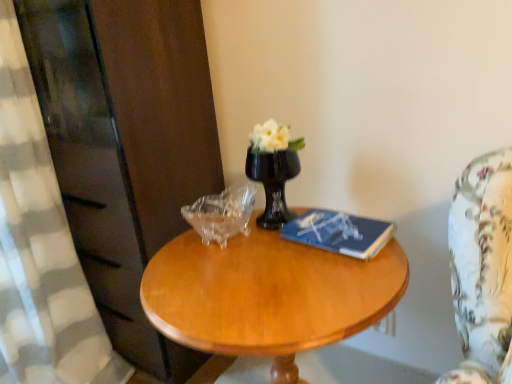
The height and width of the screenshot is (384, 512). In order to click on transparent glass piggy bank at center in this screenshot , I will do `click(222, 213)`.

What is the approximate width of blue matte book at center?

blue matte book at center is 6.33 inches wide.

Measure the distance between blue matte book at center and camera.

blue matte book at center is 36.08 inches away from camera.

This screenshot has height=384, width=512. Describe the element at coordinates (273, 183) in the screenshot. I see `black glass vase at center` at that location.

The image size is (512, 384). Find the location of `white textured curtain at left`. white textured curtain at left is located at coordinates (40, 248).

This screenshot has height=384, width=512. Describe the element at coordinates (267, 295) in the screenshot. I see `light brown wood coffee table at center` at that location.

The width and height of the screenshot is (512, 384). Find the location of `transparent glass piggy bank at center`. transparent glass piggy bank at center is located at coordinates (222, 213).

Identify the location of book located above the light brown wood coffee table at center (from a real-world perspective). The width and height of the screenshot is (512, 384). (339, 232).

Between light brown wood coffee table at center and blue matte book at center, which one is positioned in front?

light brown wood coffee table at center is in front.

In terms of width, does light brown wood coffee table at center look wider or thinner when compared to blue matte book at center?

Considering their sizes, light brown wood coffee table at center looks broader than blue matte book at center.

Which of these two, black glass vase at center or blue matte book at center, is thinner?

With smaller width is black glass vase at center.

Is black glass vase at center taller or shorter than blue matte book at center?

Considering their sizes, black glass vase at center has more height than blue matte book at center.

Would you say black glass vase at center is outside blue matte book at center?

black glass vase at center lies outside blue matte book at center's area.

Based on the photo, from a real-world perspective, who is located lower, transparent glass piggy bank at center or black glass vase at center?

From a 3D spatial view, transparent glass piggy bank at center is below.

Is transparent glass piggy bank at center far away from black glass vase at center?

transparent glass piggy bank at center is near black glass vase at center, not far away.

Which of these two, transparent glass piggy bank at center or black glass vase at center, is smaller?

With smaller size is transparent glass piggy bank at center.

Is black glass vase at center at the back of transparent glass piggy bank at center?

No, black glass vase at center is not at the back of transparent glass piggy bank at center.

From the image's perspective, is transparent glass piggy bank at center located above or below light brown wood coffee table at center?

Clearly, from the image's perspective, transparent glass piggy bank at center is above light brown wood coffee table at center.

From a real-world perspective, relative to light brown wood coffee table at center, is transparent glass piggy bank at center vertically above or below?

transparent glass piggy bank at center is above light brown wood coffee table at center.

Is transparent glass piggy bank at center behind light brown wood coffee table at center?

Yes, transparent glass piggy bank at center is further from the camera.

Can we say blue matte book at center lies outside light brown wood coffee table at center?

No.

In terms of size, does blue matte book at center appear bigger or smaller than light brown wood coffee table at center?

Considering their sizes, blue matte book at center takes up less space than light brown wood coffee table at center.

Between blue matte book at center and light brown wood coffee table at center, which one appears on the left side from the viewer's perspective?

Positioned to the left is light brown wood coffee table at center.

Considering the sizes of objects white textured curtain at left and light brown wood coffee table at center in the image provided, who is wider, white textured curtain at left or light brown wood coffee table at center?

With larger width is light brown wood coffee table at center.

Is white textured curtain at left aimed at light brown wood coffee table at center?

Yes, white textured curtain at left is aimed at light brown wood coffee table at center.

From the picture: In the image, is white textured curtain at left positioned in front of or behind light brown wood coffee table at center?

Clearly, white textured curtain at left is behind light brown wood coffee table at center.

From a real-world perspective, between light brown wood coffee table at center and white textured curtain at left, who is vertically higher?

In real-world perspective, white textured curtain at left is above.

Consider the image. Is light brown wood coffee table at center positioned far away from white textured curtain at left?

No.

From the image's perspective, is light brown wood coffee table at center on white textured curtain at left?

Actually, light brown wood coffee table at center appears below white textured curtain at left in the image.

Locate an element on the screen. The height and width of the screenshot is (384, 512). book above the light brown wood coffee table at center (from the image's perspective) is located at coordinates (339, 232).

Find the location of `vase on the left of blue matte book at center`. vase on the left of blue matte book at center is located at coordinates (273, 183).

Consider the image. Looking at the image, which one is located closer to blue matte book at center, white textured curtain at left or light brown wood coffee table at center?

light brown wood coffee table at center is positioned closer to the anchor blue matte book at center.

When comparing their distances from black glass vase at center, does blue matte book at center or transparent glass piggy bank at center seem further?

Based on the image, blue matte book at center appears to be further to black glass vase at center.

Estimate the real-world distances between objects in this image. Which object is further from light brown wood coffee table at center, blue matte book at center or black glass vase at center?

black glass vase at center.

When comparing their distances from blue matte book at center, does black glass vase at center or light brown wood coffee table at center seem closer?

black glass vase at center lies closer to blue matte book at center than the other object.

Which object lies nearer to the anchor point light brown wood coffee table at center, transparent glass piggy bank at center or blue matte book at center?

blue matte book at center.

When comparing their distances from blue matte book at center, does light brown wood coffee table at center or black glass vase at center seem further?

Among the two, light brown wood coffee table at center is located further to blue matte book at center.

From the image, which object appears to be farther from black glass vase at center, transparent glass piggy bank at center or blue matte book at center?

blue matte book at center is positioned further to the anchor black glass vase at center.

When comparing their distances from white textured curtain at left, does light brown wood coffee table at center or black glass vase at center seem further?

black glass vase at center lies further to white textured curtain at left than the other object.

You are a GUI agent. You are given a task and a screenshot of the screen. Output one action in this format:
    pyautogui.click(x=<x>, y=<y>)
    Task: Click on the candle holder located between white textured curtain at left and light brown wood coffee table at center in the left-right direction
    Image resolution: width=512 pixels, height=384 pixels.
    Given the screenshot: What is the action you would take?
    pyautogui.click(x=222, y=213)

Locate an element on the screen. The height and width of the screenshot is (384, 512). candle holder situated between white textured curtain at left and black glass vase at center from left to right is located at coordinates (222, 213).

This screenshot has width=512, height=384. Identify the location of vase between transparent glass piggy bank at center and blue matte book at center in the horizontal direction. tap(273, 183).

Find the location of a particular element. The image size is (512, 384). book that lies between transparent glass piggy bank at center and light brown wood coffee table at center from top to bottom is located at coordinates (339, 232).